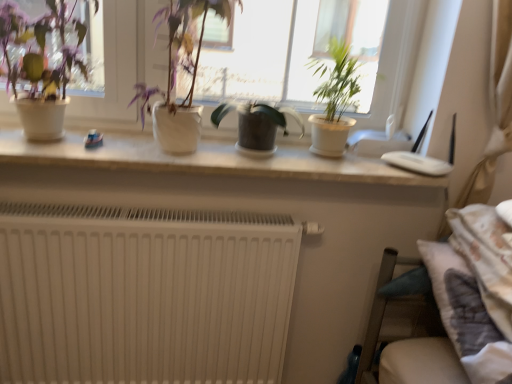
Question: Is green matte plant at center, which is counted as the second houseplant, starting from the right, further to camera compared to white matte radiator at lower left?

Choices:
 (A) no
 (B) yes

Answer: (B)

Question: From a real-world perspective, is green matte plant at center, the 3th houseplant viewed from the left, on top of white matte radiator at lower left?

Choices:
 (A) yes
 (B) no

Answer: (A)

Question: Does green matte plant at center, the 3th houseplant viewed from the left, contain white matte radiator at lower left?

Choices:
 (A) no
 (B) yes

Answer: (A)

Question: Does green matte plant at center, which is counted as the second houseplant, starting from the right, appear on the left side of white matte radiator at lower left?

Choices:
 (A) no
 (B) yes

Answer: (A)

Question: Is green matte plant at center, which is counted as the second houseplant, starting from the right, placed right next to white matte radiator at lower left?

Choices:
 (A) yes
 (B) no

Answer: (B)

Question: Is green matte plant at center, which is counted as the second houseplant, starting from the right, shorter than white matte radiator at lower left?

Choices:
 (A) no
 (B) yes

Answer: (B)

Question: Can you confirm if white matte radiator at lower left is bigger than green matte plant at upper right, positioned as the first houseplant in right-to-left order?

Choices:
 (A) yes
 (B) no

Answer: (A)

Question: Is white matte radiator at lower left positioned behind green matte plant at upper right, positioned as the first houseplant in right-to-left order?

Choices:
 (A) yes
 (B) no

Answer: (A)

Question: Could you tell me if white matte radiator at lower left is facing green matte plant at upper right, positioned as the first houseplant in right-to-left order?

Choices:
 (A) no
 (B) yes

Answer: (A)

Question: Is white matte radiator at lower left looking in the opposite direction of green matte plant at upper right, positioned as the first houseplant in right-to-left order?

Choices:
 (A) yes
 (B) no

Answer: (B)

Question: Can you confirm if white matte radiator at lower left is smaller than green matte plant at upper right, positioned as the fourth houseplant in left-to-right order?

Choices:
 (A) yes
 (B) no

Answer: (B)

Question: From the image's perspective, would you say white matte radiator at lower left is positioned over green matte plant at upper right, positioned as the first houseplant in right-to-left order?

Choices:
 (A) no
 (B) yes

Answer: (A)

Question: From a real-world perspective, is matte white pot at upper left, the 1th houseplant from the left, located beneath green matte plant at upper right, positioned as the first houseplant in right-to-left order?

Choices:
 (A) no
 (B) yes

Answer: (A)